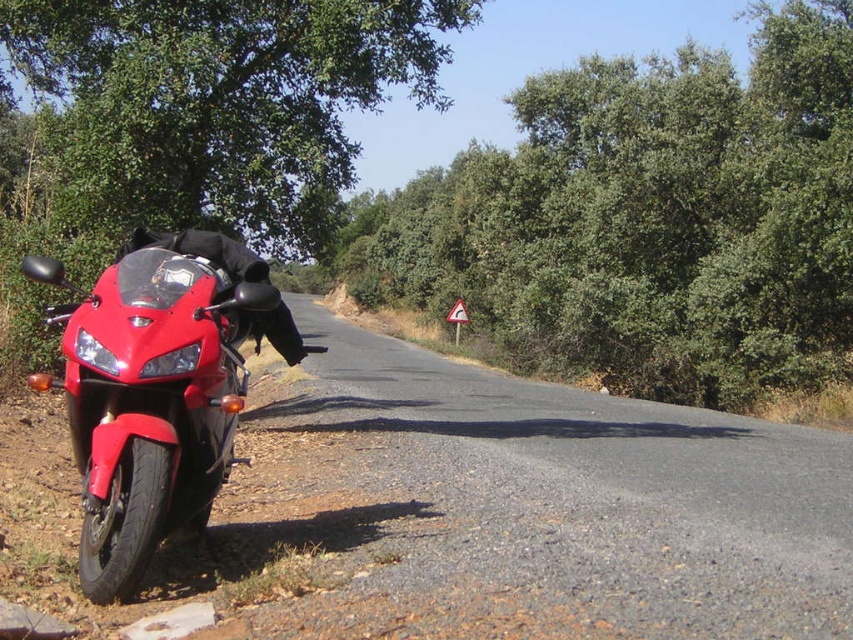
Question: Which object appears farthest from the camera in this image?

Choices:
 (A) glossy red motorcycle at left
 (B) green leafy tree at upper left
 (C) green leafy tree at center

Answer: (C)

Question: Is green leafy tree at upper left wider than glossy red motorcycle at left?

Choices:
 (A) yes
 (B) no

Answer: (A)

Question: Is the position of green leafy tree at upper left less distant than that of glossy red motorcycle at left?

Choices:
 (A) yes
 (B) no

Answer: (B)

Question: Which of the following is the farthest from the observer?

Choices:
 (A) (119, 376)
 (B) (259, 218)
 (C) (519, 150)

Answer: (C)

Question: Among these points, which one is nearest to the camera?

Choices:
 (A) (669, 296)
 (B) (68, 145)

Answer: (B)

Question: Is green leafy tree at center to the right of glossy red motorcycle at left from the viewer's perspective?

Choices:
 (A) yes
 (B) no

Answer: (A)